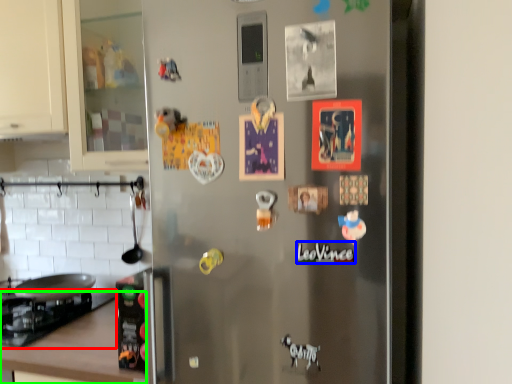
Question: Which is farther away from gas stove (highlighted by a red box)? writing (highlighted by a blue box) or counter top (highlighted by a green box)?

Choices:
 (A) writing
 (B) counter top

Answer: (A)